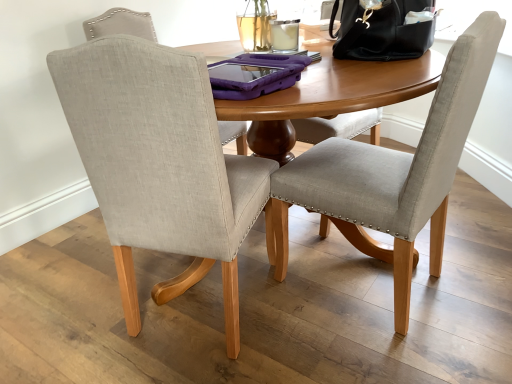
Find the location of a particular element. The image size is (512, 384). free spot to the left of beige fabric chair at center, the second chair in the right-to-left sequence is located at coordinates (79, 314).